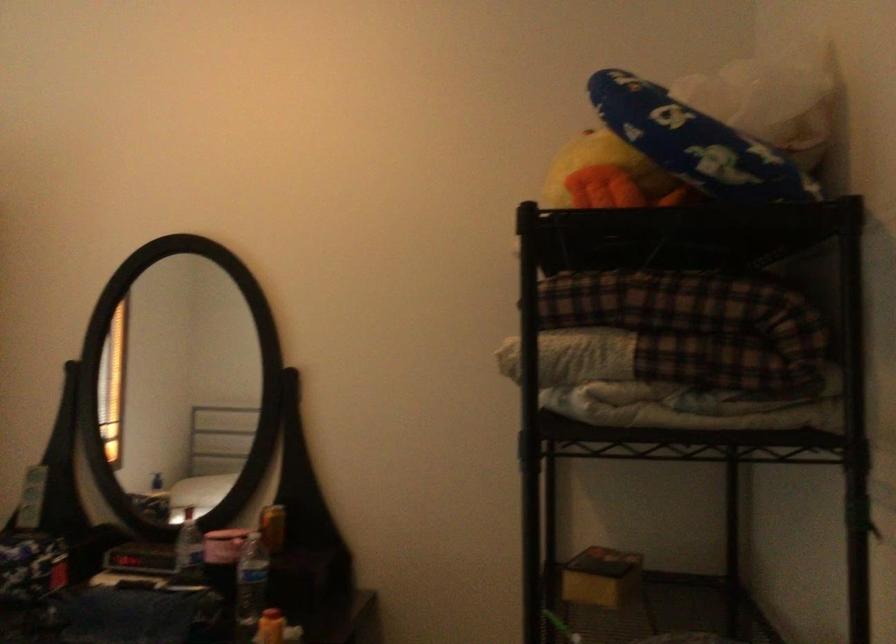
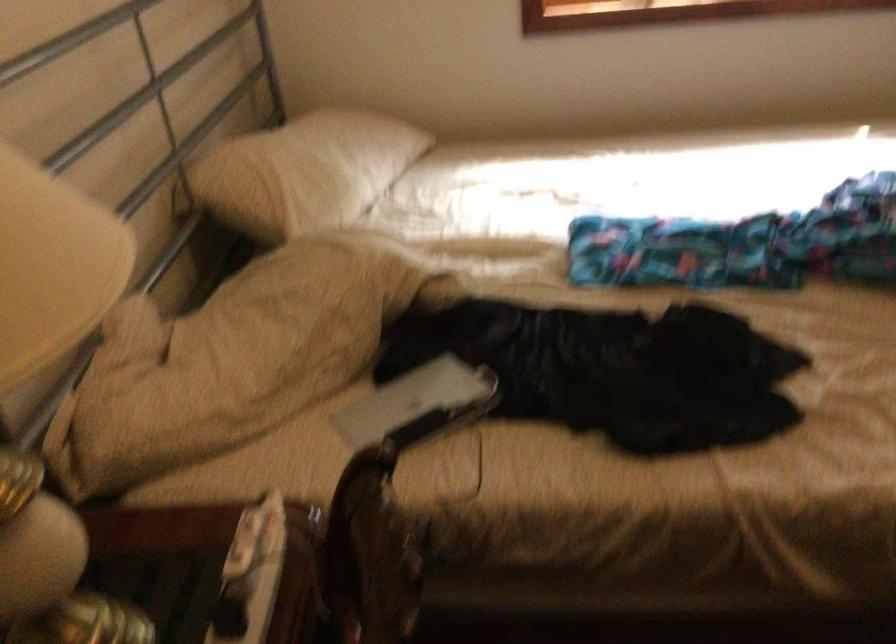
First-person continuous shooting, in which direction is the camera rotating?

The rotation direction of the camera is left-down.